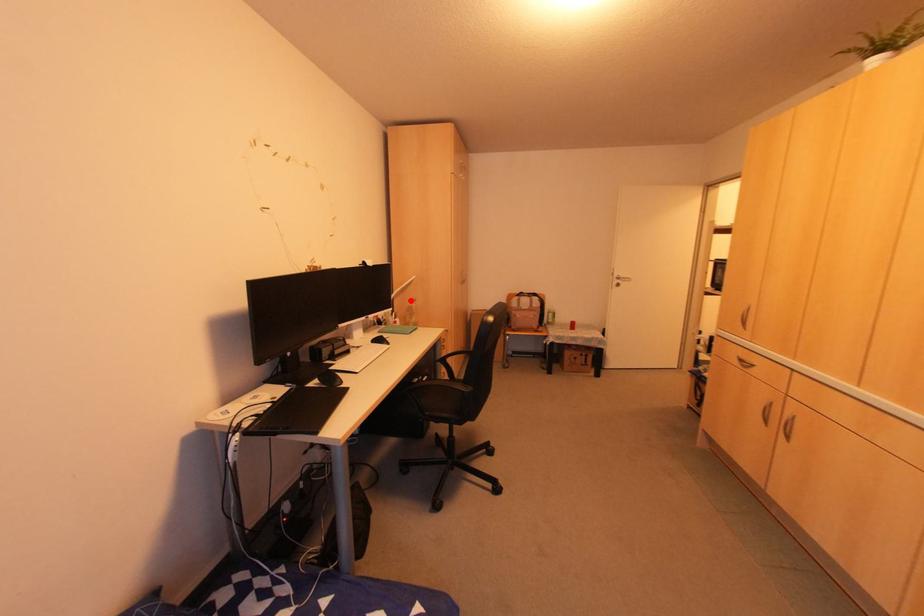
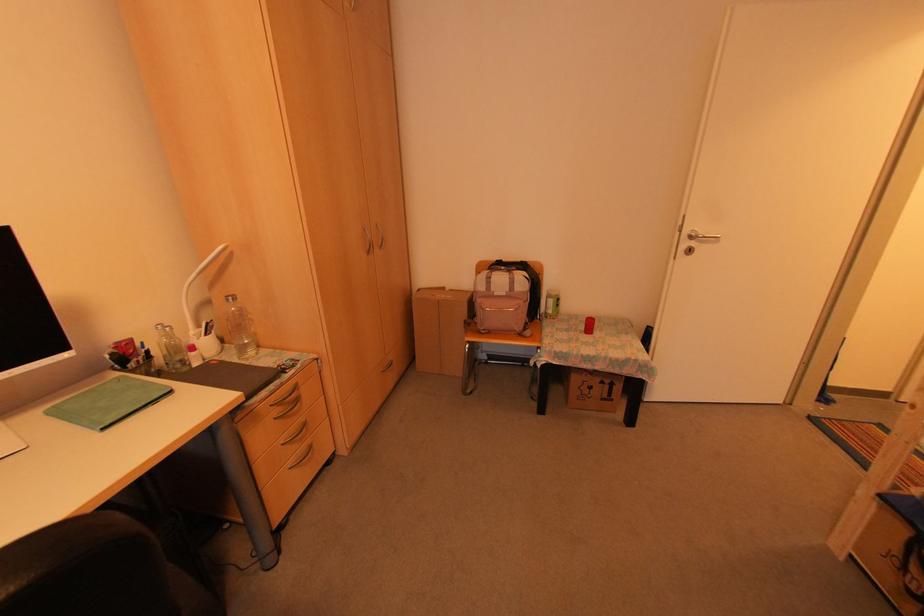
In the second image, find the point that corresponds to the highlighted location in the first image.

(225, 300)